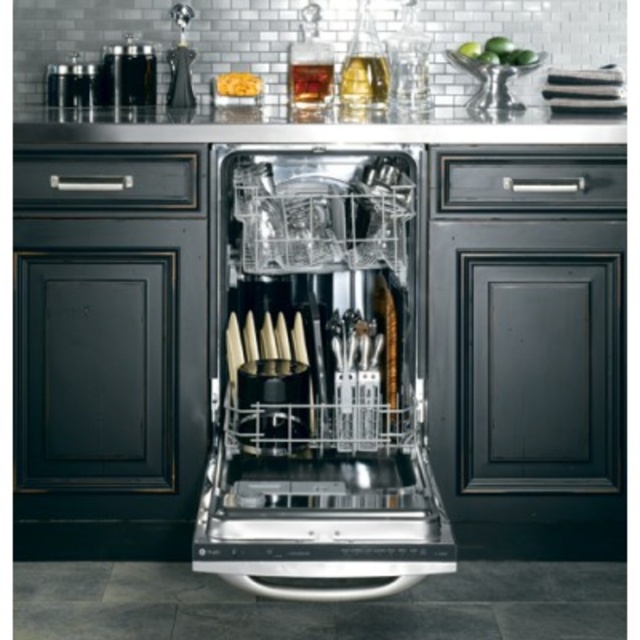
Question: In this image, where is satin steel countertop at upper center located relative to satin nickel salt and pepper shakers at left?

Choices:
 (A) below
 (B) above

Answer: (A)

Question: Does satin steel dishwasher at center have a larger size compared to satin steel countertop at upper center?

Choices:
 (A) no
 (B) yes

Answer: (B)

Question: Which point is closer to the camera?

Choices:
 (A) satin steel countertop at upper center
 (B) satin nickel salt and pepper shakers at left

Answer: (A)

Question: Does satin steel countertop at upper center have a greater width compared to satin nickel salt and pepper shakers at left?

Choices:
 (A) yes
 (B) no

Answer: (A)

Question: Considering the real-world distances, which object is closest to the satin steel countertop at upper center?

Choices:
 (A) satin nickel salt and pepper shakers at left
 (B) satin steel dishwasher at center

Answer: (A)

Question: Which object is farther from the camera taking this photo?

Choices:
 (A) satin steel dishwasher at center
 (B) satin nickel salt and pepper shakers at left

Answer: (B)